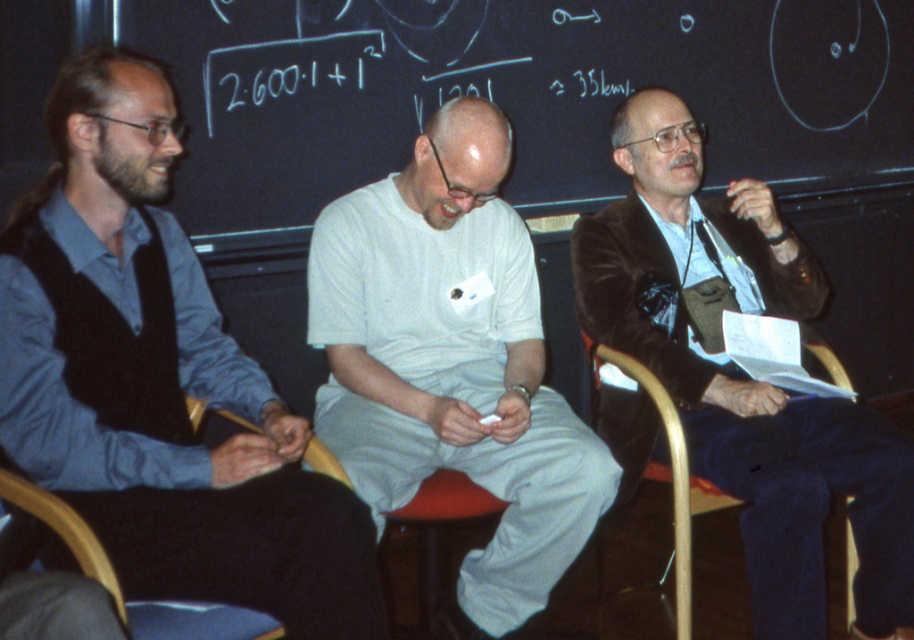
Question: From the image, what is the correct spatial relationship of white cotton shirt at center in relation to velvet brown jacket at center?

Choices:
 (A) left
 (B) right

Answer: (A)

Question: Which object appears farthest from the camera in this image?

Choices:
 (A) white cotton shirt at center
 (B) wooden chair at lower right
 (C) matte black vest at left
 (D) black chalkboard at upper center

Answer: (D)

Question: From the image, what is the correct spatial relationship of black chalkboard at upper center in relation to velvet brown jacket at center?

Choices:
 (A) right
 (B) left

Answer: (B)

Question: Which point appears closest to the camera in this image?

Choices:
 (A) [x=748, y=464]
 (B) [x=502, y=4]
 (C) [x=158, y=301]

Answer: (C)

Question: In this image, where is matte black vest at left located relative to white cotton shirt at center?

Choices:
 (A) below
 (B) above

Answer: (B)

Question: Which is nearer to the black chalkboard at upper center?

Choices:
 (A) matte black vest at left
 (B) velvet brown jacket at center
 (C) white cotton shirt at center

Answer: (C)